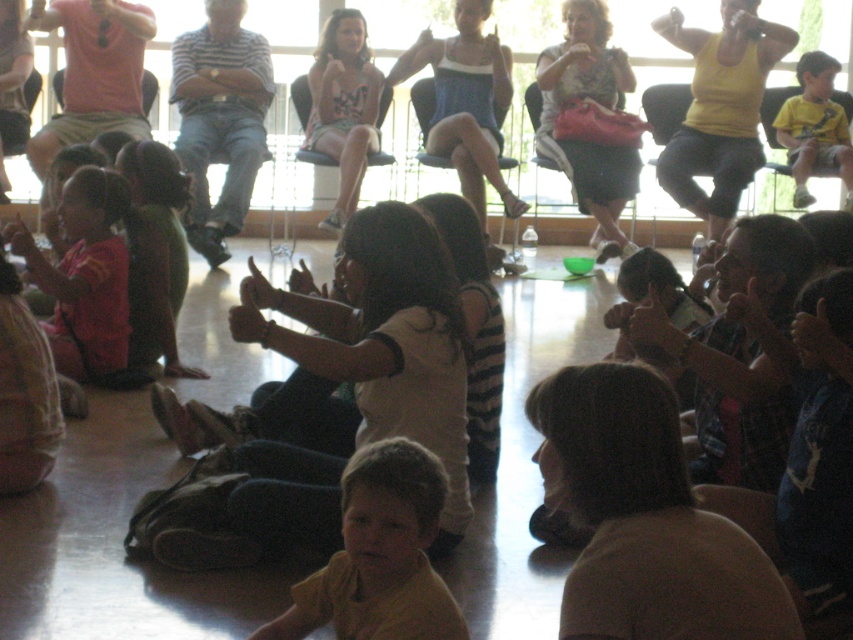
Question: Based on their relative distances, which object is farther from the floral dress at center?

Choices:
 (A) striped shirt at center
 (B) matte black dress at upper center

Answer: (B)

Question: Estimate the real-world distances between objects in this image. Which object is farther from the striped shirt at center?

Choices:
 (A) green fabric dress at center
 (B) floral dress at center
 (C) yellow matte shirt at upper right

Answer: (C)

Question: Does yellow matte shirt at lower center appear on the left side of matte black dress at upper center?

Choices:
 (A) yes
 (B) no

Answer: (A)

Question: Is yellow matte shirt at lower center behind floral dress at center?

Choices:
 (A) no
 (B) yes

Answer: (A)

Question: Is matte black dress at upper center closer to the viewer compared to floral dress at center?

Choices:
 (A) no
 (B) yes

Answer: (A)

Question: Which point is farther from the camera taking this photo?

Choices:
 (A) (625, 140)
 (B) (639, 536)
 (C) (834, 164)

Answer: (A)